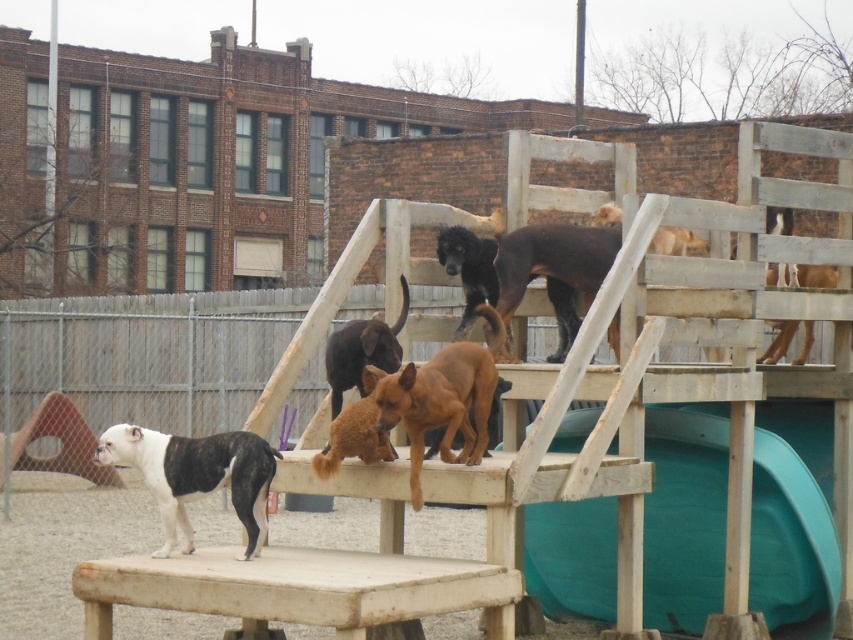
You are a drone operator trying to capture aerial footage of the dog park. Your drone is currently hovering at point A, which is at coordinates point (544, 230), and you want to move it to point B at coordinates point (780, 330). Considering the spatial relationship between these two points, which direction should you move the drone to get closer to the target point?

To move the drone from point (544, 230) to point (780, 330), you should move it upward and to the right since point (780, 330) is further away from the viewer compared to point (544, 230).

You are a dog owner trying to locate your pets in the dog park. Your black glossy dog at upper center and brown furry dog at center are both visible. Which dog is positioned higher in the wooden playhouse structure?

The black glossy dog at upper center is positioned higher in the wooden playhouse structure than the brown furry dog at center, as it is located above the brown furry dog at center.